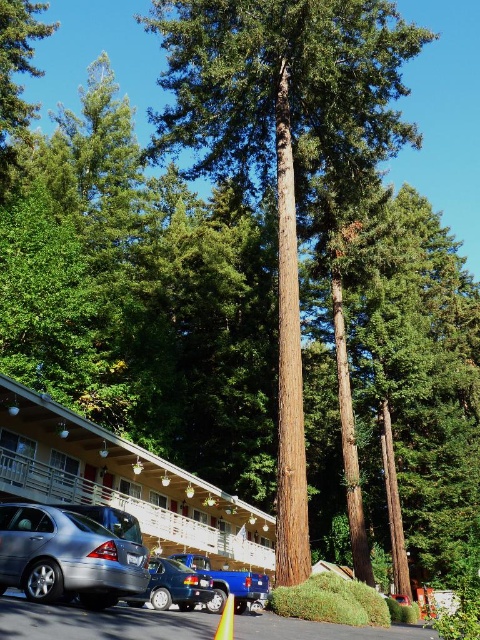
You are standing in front of the brown rough textured tree at center and want to place the yellow reflective plastic traffic cone at lower center in a visible spot for hikers. Based on the scene, is the traffic cone currently positioned behind or in front of the tree?

The yellow reflective plastic traffic cone at lower center is behind the brown rough textured tree at center, so it might be obstructed and not easily visible to hikers.

You are a photographer planning to take a photo of the white matte hotel at lower left and the metallic blue sedan at lower center. Since you want both objects to be clearly visible in the frame, which object should you focus on to ensure proper focus given their sizes?

The white matte hotel at lower left has a larger size compared to the metallic blue sedan at lower center, so you should focus on the white matte hotel at lower left to ensure proper focus as it takes up more space in the frame.

You are standing in the middle of the forest path and see the white matte hotel at lower left and the yellow reflective plastic traffic cone at lower center. Which object is closer to you?

The white matte hotel at lower left is closer to you because it is further to the viewer than the yellow reflective plastic traffic cone at lower center.